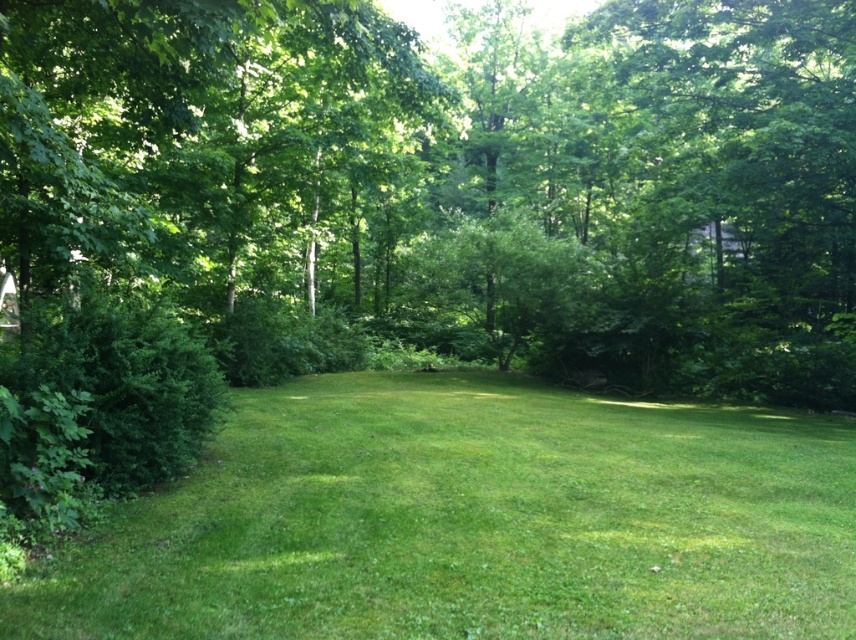
Question: Is green leafy tree at center positioned behind green grass at center?

Choices:
 (A) yes
 (B) no

Answer: (A)

Question: Among these objects, which one is nearest to the camera?

Choices:
 (A) green leafy tree at center
 (B) green grass at center

Answer: (B)

Question: Which of the following is the farthest from the observer?

Choices:
 (A) green grass at center
 (B) green leafy tree at center

Answer: (B)

Question: Can you confirm if green leafy tree at center is positioned to the left of green grass at center?

Choices:
 (A) no
 (B) yes

Answer: (A)

Question: Can you confirm if green leafy tree at center is positioned to the right of green grass at center?

Choices:
 (A) no
 (B) yes

Answer: (B)